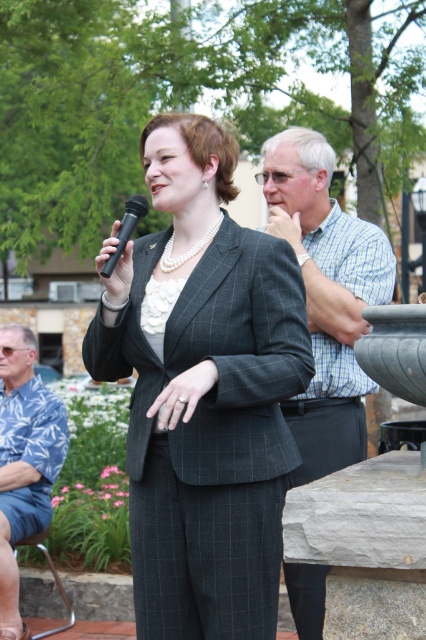
You are a photographer taking a picture of the scene. You notice two points in the image at coordinates point (x=210, y=358) and point (x=106, y=276). Which point is closer to your camera?

Point (x=210, y=358) is closer to the camera than point (x=106, y=276).

You are a photographer standing at the back of the room. You need to take a photo of the checkered shirt at center and the black plastic microphone at upper center. Can you ensure both are in focus if your camera has a depth of field that can cover 1.5 meters?

The checkered shirt at center is 1.43 meters from the black plastic microphone at upper center. Since the distance between them is less than 1.5 meters, both will be in focus if the camera is focused appropriately.